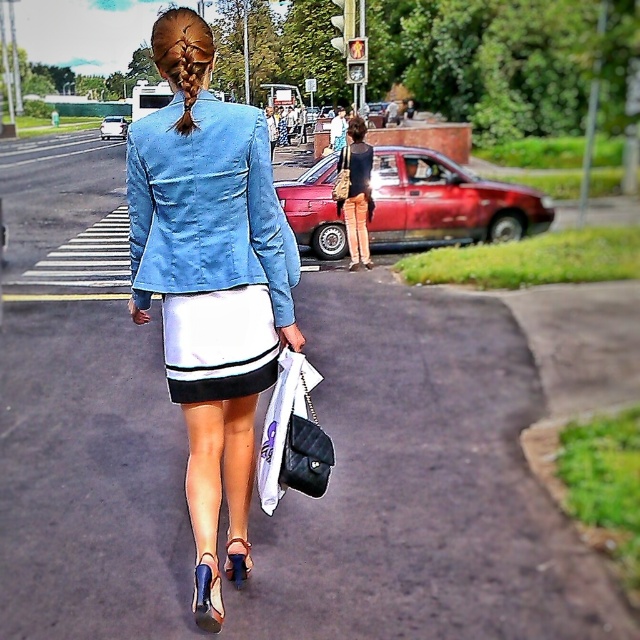
Who is positioned more to the right, white satin skirt at center or black leather handbag at center?

Positioned to the right is black leather handbag at center.

Identify the location of white satin skirt at center. The image size is (640, 640). (218, 344).

Between point (257, 371) and point (349, 179), which one is positioned behind?

The point (349, 179) is more distant.

You are a GUI agent. You are given a task and a screenshot of the screen. Output one action in this format:
    pyautogui.click(x=<x>, y=<y>)
    Task: Click on the white satin skirt at center
    This screenshot has height=640, width=640.
    Given the screenshot: What is the action you would take?
    [x=218, y=344]

Does point (241, 212) lie in front of point (332, 182)?

Yes, point (241, 212) is in front of point (332, 182).

Who is higher up, denim jacket at center or metallic red car at center?

metallic red car at center

Measure the distance between point (141, 179) and camera.

They are 3.19 meters apart.

Where is `denim jacket at center`? This screenshot has width=640, height=640. denim jacket at center is located at coordinates (212, 304).

Can you confirm if matte black tank top at center is thinner than black leather handbag at center?

In fact, matte black tank top at center might be wider than black leather handbag at center.

Based on the photo, who is more forward, (355,225) or (348,188)?

Point (348,188)

Locate an element on the screen. matte black tank top at center is located at coordinates (356, 193).